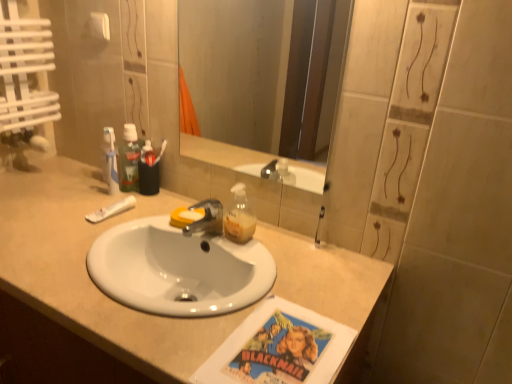
Question: Is beige laminate countertop at center completely or partially inside white matte tube at left?

Choices:
 (A) yes
 (B) no

Answer: (B)

Question: Are white matte tube at left and beige laminate countertop at center far apart?

Choices:
 (A) no
 (B) yes

Answer: (A)

Question: Is the surface of white matte tube at left in direct contact with beige laminate countertop at center?

Choices:
 (A) yes
 (B) no

Answer: (B)

Question: Is white matte tube at left behind beige laminate countertop at center?

Choices:
 (A) yes
 (B) no

Answer: (A)

Question: From a real-world perspective, is white matte tube at left beneath beige laminate countertop at center?

Choices:
 (A) no
 (B) yes

Answer: (A)

Question: Considering the positions of clear glass mirror at upper center and metallic silver tap at center in the image, is clear glass mirror at upper center wider or thinner than metallic silver tap at center?

Choices:
 (A) thin
 (B) wide

Answer: (A)

Question: Is clear glass mirror at upper center to the left or to the right of metallic silver tap at center in the image?

Choices:
 (A) right
 (B) left

Answer: (A)

Question: From the image's perspective, is clear glass mirror at upper center located above or below metallic silver tap at center?

Choices:
 (A) above
 (B) below

Answer: (A)

Question: In terms of height, does clear glass mirror at upper center look taller or shorter compared to metallic silver tap at center?

Choices:
 (A) short
 (B) tall

Answer: (B)

Question: In terms of height, does green plastic mouthwash at upper left look taller or shorter compared to clear glass mirror at upper center?

Choices:
 (A) tall
 (B) short

Answer: (B)

Question: Is green plastic mouthwash at upper left bigger or smaller than clear glass mirror at upper center?

Choices:
 (A) big
 (B) small

Answer: (B)

Question: Considering the relative positions of green plastic mouthwash at upper left and clear glass mirror at upper center in the image provided, is green plastic mouthwash at upper left to the left or to the right of clear glass mirror at upper center?

Choices:
 (A) left
 (B) right

Answer: (A)

Question: Is point (129, 129) closer or farther from the camera than point (202, 74)?

Choices:
 (A) closer
 (B) farther

Answer: (A)

Question: Relative to beige laminate countertop at center, is clear glass mirror at upper center in front or behind?

Choices:
 (A) behind
 (B) front

Answer: (A)

Question: Considering the positions of clear glass mirror at upper center and beige laminate countertop at center in the image, is clear glass mirror at upper center wider or thinner than beige laminate countertop at center?

Choices:
 (A) thin
 (B) wide

Answer: (A)